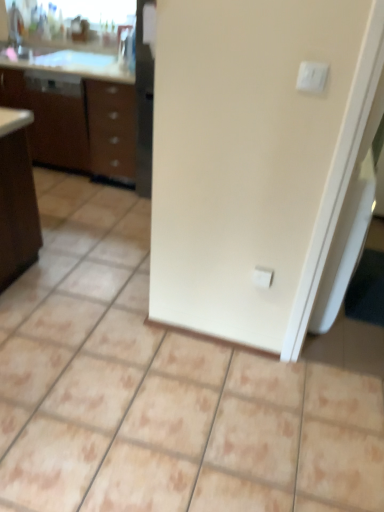
In order to face white plastic light switch at upper right, should I rotate leftwards or rightwards?

Turn right approximately 15.531 degrees to face it.

The height and width of the screenshot is (512, 384). Find the location of `white glossy sink at upper left`. white glossy sink at upper left is located at coordinates (24, 24).

Measure the distance between white glossy sink at upper left and brown wood/file cabinet at left.

A distance of 26.03 inches exists between white glossy sink at upper left and brown wood/file cabinet at left.

From a real-world perspective, is white glossy sink at upper left below brown wood/file cabinet at left?

Actually, white glossy sink at upper left is physically above brown wood/file cabinet at left in the real world.

Would you say white glossy sink at upper left is to the left or to the right of brown wood/file cabinet at left in the picture?

Based on their positions, white glossy sink at upper left is located to the right of brown wood/file cabinet at left.

From the image's perspective, is white glossy sink at upper left located above or below brown wood/file cabinet at left?

Based on their image positions, white glossy sink at upper left is located above brown wood/file cabinet at left.

Is white glossy sink at upper left in contact with white plastic light switch at upper right?

No, white glossy sink at upper left is not with white plastic light switch at upper right.

From the image's perspective, which one is positioned lower, white glossy sink at upper left or white plastic light switch at upper right?

white plastic light switch at upper right appears lower in the image.

From a real-world perspective, which is physically below, white glossy sink at upper left or white plastic light switch at upper right?

From a 3D spatial view, white glossy sink at upper left is below.

Does point (20, 9) lie in front of point (314, 66)?

No, it is not.

From a real-world perspective, is white plastic light switch at upper right below white glossy sink at upper left?

No, from a real-world perspective, white plastic light switch at upper right is not under white glossy sink at upper left.

Which of these two, white plastic light switch at upper right or white glossy sink at upper left, is wider?

Wider between the two is white glossy sink at upper left.

From the image's perspective, is white plastic light switch at upper right on white glossy sink at upper left?

No, from the image's perspective, white plastic light switch at upper right is not above white glossy sink at upper left.

How many degrees apart are the facing directions of white plastic electric outlet at center and white plastic light switch at upper right?

The angle between the facing direction of white plastic electric outlet at center and the facing direction of white plastic light switch at upper right is 0.00198 degrees.

How distant is white plastic electric outlet at center from white plastic light switch at upper right?

white plastic electric outlet at center is 30.40 inches away from white plastic light switch at upper right.

Is point (265, 271) positioned in front of point (319, 85)?

No, it is not.

Does white plastic electric outlet at center have a greater height compared to white plastic light switch at upper right?

Yes.

Considering the positions of objects white plastic electric outlet at center and brown wood/file cabinet at left in the image provided, who is more to the left, white plastic electric outlet at center or brown wood/file cabinet at left?

Positioned to the left is brown wood/file cabinet at left.

From a real-world perspective, who is located higher, white plastic electric outlet at center or brown wood/file cabinet at left?

From a 3D spatial view, brown wood/file cabinet at left is above.

From the image's perspective, which is below, white plastic electric outlet at center or brown wood/file cabinet at left?

white plastic electric outlet at center is shown below in the image.

Considering the sizes of objects white plastic electric outlet at center and brown wood/file cabinet at left in the image provided, who is thinner, white plastic electric outlet at center or brown wood/file cabinet at left?

Thinner between the two is white plastic electric outlet at center.

Considering the sizes of objects white plastic light switch at upper right and white plastic electric outlet at center in the image provided, who is bigger, white plastic light switch at upper right or white plastic electric outlet at center?

With larger size is white plastic electric outlet at center.

Would you say white plastic light switch at upper right contains white plastic electric outlet at center?

No, white plastic electric outlet at center is not surrounded by white plastic light switch at upper right.

Measure the distance from white plastic light switch at upper right to white plastic electric outlet at center.

white plastic light switch at upper right is 30.40 inches away from white plastic electric outlet at center.

Can you confirm if white plastic light switch at upper right is thinner than white plastic electric outlet at center?

Indeed, white plastic light switch at upper right has a lesser width compared to white plastic electric outlet at center.

Are brown wood/file cabinet at left and white glossy sink at upper left far apart?

No, brown wood/file cabinet at left is not far from white glossy sink at upper left.

From a real-world perspective, is brown wood/file cabinet at left positioned under white glossy sink at upper left based on gravity?

Correct, in the physical world, brown wood/file cabinet at left is lower than white glossy sink at upper left.

Is brown wood/file cabinet at left not inside white glossy sink at upper left?

brown wood/file cabinet at left is positioned outside white glossy sink at upper left.

Who is more distant, brown wood/file cabinet at left or white glossy sink at upper left?

white glossy sink at upper left is behind.

I want to click on sink above the brown wood/file cabinet at left (from a real-world perspective), so [24, 24].

At what (x,y) coordinates should I click in order to perform the action: click on light switch below the white glossy sink at upper left (from the image's perspective). Please return your answer as a coordinate pair (x, y). Image resolution: width=384 pixels, height=512 pixels. Looking at the image, I should click on (312, 76).

From the image, which object appears to be farther from brown wood/file cabinet at left, white glossy sink at upper left or white plastic electric outlet at center?

The object further to brown wood/file cabinet at left is white plastic electric outlet at center.

From the image, which object appears to be farther from white plastic light switch at upper right, white plastic electric outlet at center or brown wood/file cabinet at left?

brown wood/file cabinet at left is positioned further to the anchor white plastic light switch at upper right.

Looking at the image, which one is located further to white glossy sink at upper left, brown wood/file cabinet at left or white plastic light switch at upper right?

white plastic light switch at upper right is positioned further to the anchor white glossy sink at upper left.

From the image, which object appears to be nearer to white plastic light switch at upper right, white glossy sink at upper left or white plastic electric outlet at center?

The object closer to white plastic light switch at upper right is white plastic electric outlet at center.

Based on their spatial positions, is brown wood/file cabinet at left or white plastic electric outlet at center further from white glossy sink at upper left?

Among the two, white plastic electric outlet at center is located further to white glossy sink at upper left.

When comparing their distances from brown wood/file cabinet at left, does white plastic light switch at upper right or white plastic electric outlet at center seem further?

white plastic light switch at upper right.

From the image, which object appears to be farther from brown wood/file cabinet at left, white plastic light switch at upper right or white glossy sink at upper left?

Based on the image, white plastic light switch at upper right appears to be further to brown wood/file cabinet at left.

Which object lies nearer to the anchor point white plastic light switch at upper right, brown wood/file cabinet at left or white plastic electric outlet at center?

white plastic electric outlet at center lies closer to white plastic light switch at upper right than the other object.

Find the location of `electric outlet between brown wood/file cabinet at left and white plastic light switch at upper right`. electric outlet between brown wood/file cabinet at left and white plastic light switch at upper right is located at coordinates (262, 277).

The image size is (384, 512). What are the coordinates of `electric outlet between white glossy sink at upper left and white plastic light switch at upper right from left to right` in the screenshot? It's located at (x=262, y=277).

Image resolution: width=384 pixels, height=512 pixels. Identify the location of file cabinet between white plastic light switch at upper right and white glossy sink at upper left along the z-axis. (51, 115).

At what (x,y) coordinates should I click in order to perform the action: click on file cabinet between white glossy sink at upper left and white plastic electric outlet at center in the up-down direction. Please return your answer as a coordinate pair (x, y). Looking at the image, I should click on (51, 115).